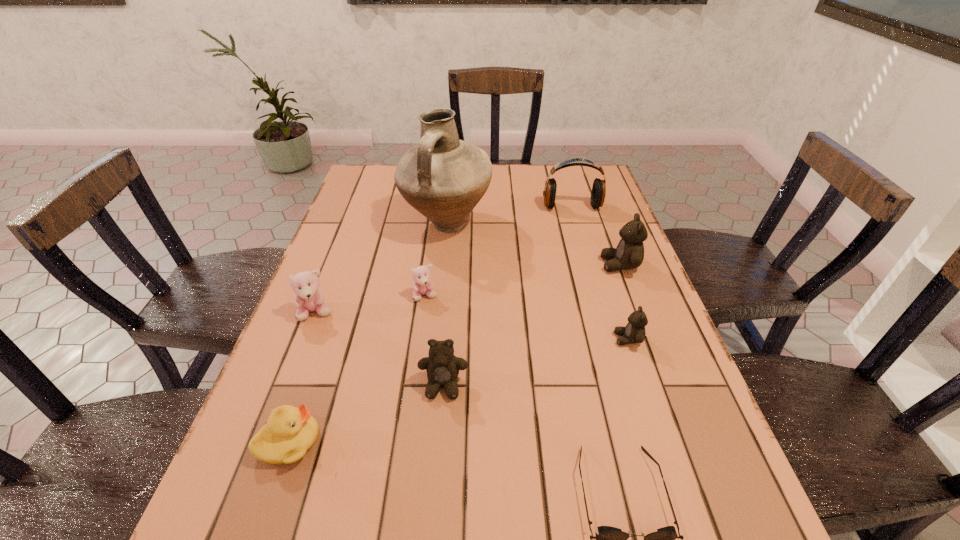
Identify the location of the smaller pink teddy bear. The height and width of the screenshot is (540, 960). (422, 285).

Where is `yellow duckling`? The width and height of the screenshot is (960, 540). yellow duckling is located at coordinates (290, 432).

Where is `free space located on the handle side of the pitcher`? This screenshot has width=960, height=540. free space located on the handle side of the pitcher is located at coordinates (442, 271).

This screenshot has width=960, height=540. In order to click on free space located 0.070m on the ear cups of the headset in this screenshot , I will do `click(578, 226)`.

I want to click on blank area located 0.290m on the face of the tallest teddy bear, so click(x=492, y=265).

Locate an element on the screen. free space located on the face of the tallest teddy bear is located at coordinates (459, 265).

The width and height of the screenshot is (960, 540). Find the location of `blank area located 0.100m on the face of the tallest teddy bear`. blank area located 0.100m on the face of the tallest teddy bear is located at coordinates (564, 265).

Find the location of `vacant space located on the face of the nearest teddy bear`. vacant space located on the face of the nearest teddy bear is located at coordinates (434, 517).

Find the location of a particular element. This screenshot has height=540, width=960. vacant space located 0.370m at the face of the left pink teddy bear is located at coordinates pos(249,487).

Where is `free space located on the face of the second farthest brown teddy bear`? The width and height of the screenshot is (960, 540). free space located on the face of the second farthest brown teddy bear is located at coordinates (588, 339).